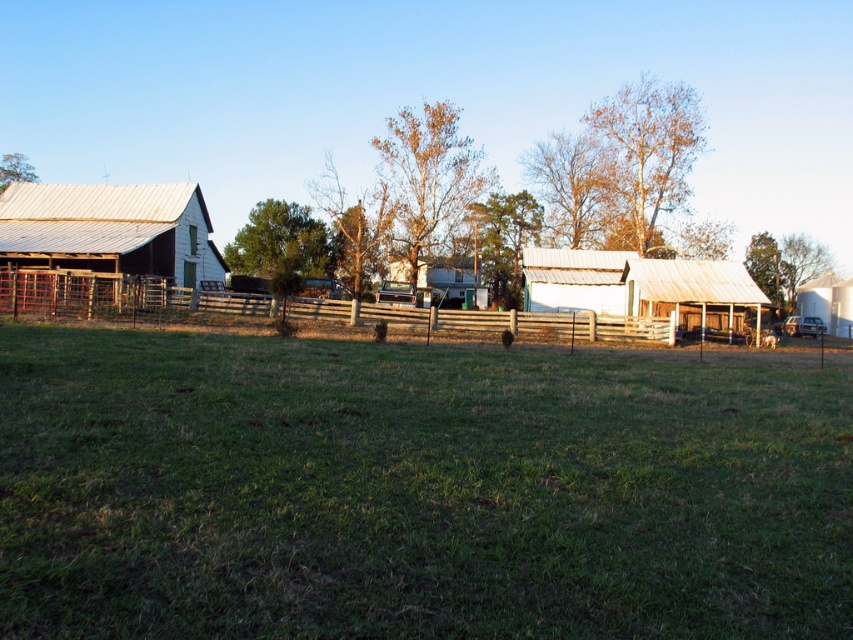
You are a farmer standing at the edge of the field. You need to walk to the white corrugated metal barn at center. Which direction should you head relative to the wooden fence at center?

You should head to the right of the wooden fence at center to reach the white corrugated metal barn at center since the wooden fence at center is to the left of it.

What are the coordinates of the white corrugated metal barn at center?

The white corrugated metal barn at center is located at coordinates point (642, 285).